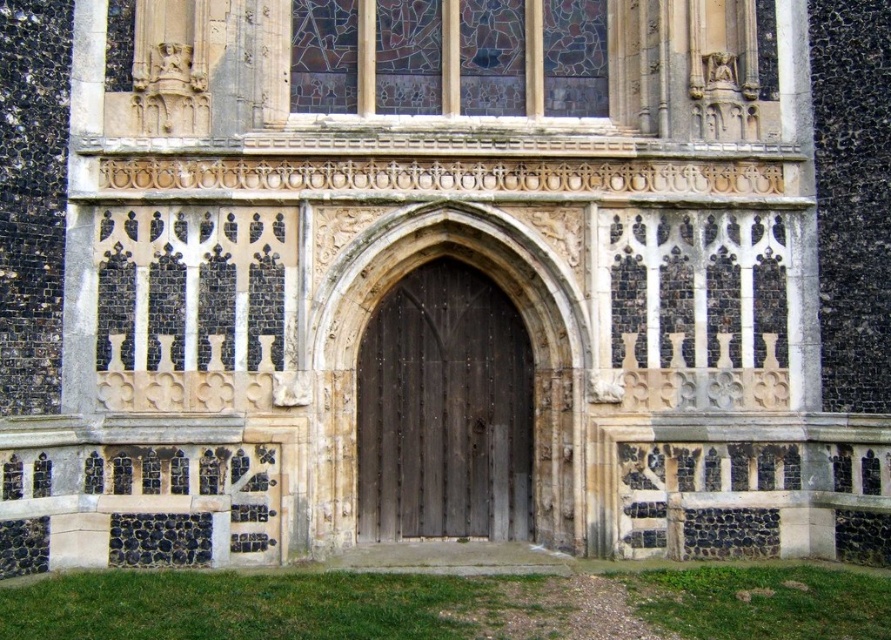
You are standing in front of the historic building and want to take a photo of both the dark wood door at center and the stained glass at upper center. However, you can only focus on one object at a time. Which object should you focus on to ensure the other is still in the background?

You should focus on the dark wood door at center because it is closer to the viewer than the stained glass at upper center, so the stained glass will naturally be in the background and still in focus.